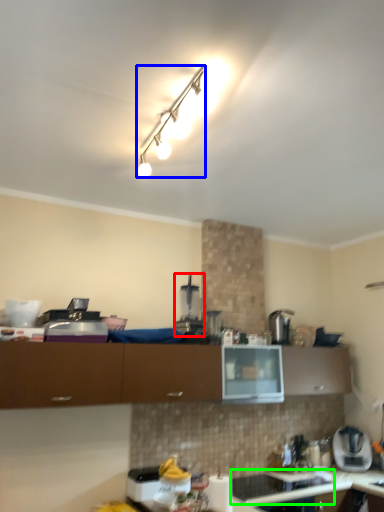
Question: Which object is the farthest from coffee machine (highlighted by a red box)? Choose among these: lamp (highlighted by a blue box) or appliance (highlighted by a green box).

Choices:
 (A) lamp
 (B) appliance

Answer: (B)